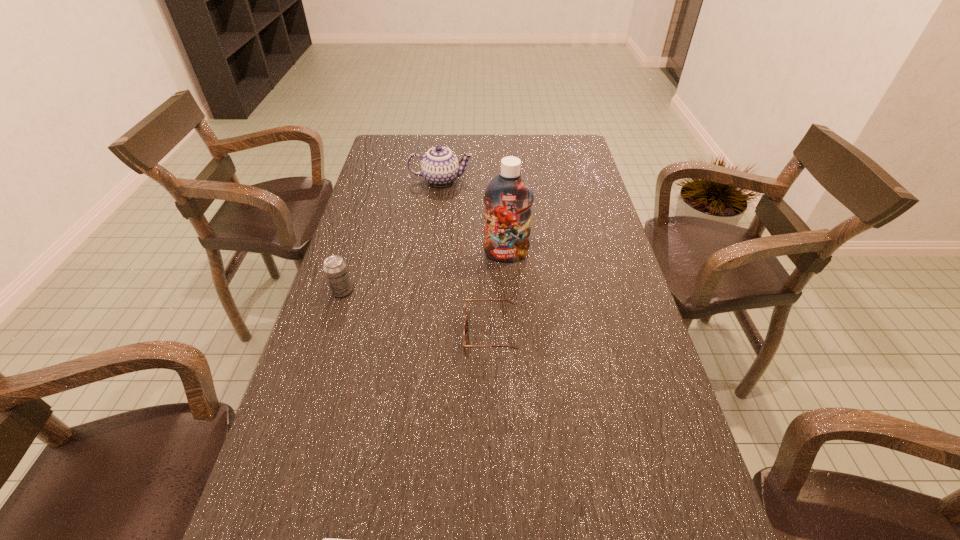
The height and width of the screenshot is (540, 960). In order to click on free space between the second shortest object and the third nearest object in this screenshot , I will do `click(417, 313)`.

Where is `vacant space that's between the leftmost object and the second tallest object`? Image resolution: width=960 pixels, height=540 pixels. vacant space that's between the leftmost object and the second tallest object is located at coordinates (392, 236).

Locate an element on the screen. empty location between the shampoo and the fourth farthest object is located at coordinates (498, 295).

I want to click on empty location between the second shortest object and the farthest object, so click(466, 258).

Locate an element on the screen. The width and height of the screenshot is (960, 540). free space that is in between the shampoo and the second tallest object is located at coordinates (473, 218).

Image resolution: width=960 pixels, height=540 pixels. Find the location of `free space between the chinaware and the beer can`. free space between the chinaware and the beer can is located at coordinates (392, 236).

What are the coordinates of `vacant region between the chinaware and the fourth tallest object` in the screenshot? It's located at point(466,258).

The height and width of the screenshot is (540, 960). Find the location of `the second closest object to the nearest object`. the second closest object to the nearest object is located at coordinates (335, 269).

Image resolution: width=960 pixels, height=540 pixels. I want to click on object that can be found as the second closest to the nearest object, so click(x=335, y=269).